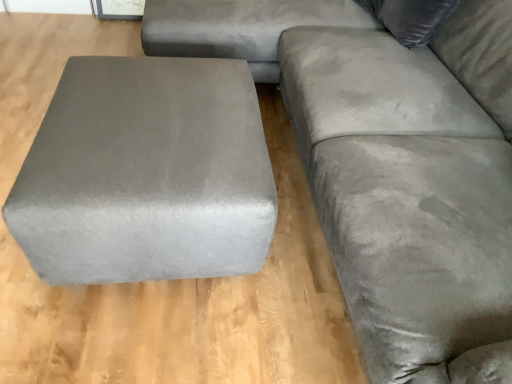
Question: Is point (233, 173) positioned closer to the camera than point (502, 286)?

Choices:
 (A) closer
 (B) farther

Answer: (B)

Question: From a real-world perspective, is satin gray ottoman at left positioned above or below suede gray couch at right?

Choices:
 (A) below
 (B) above

Answer: (A)

Question: Which is farther from the suede gray couch at right?

Choices:
 (A) satin gray ottoman at left
 (B) velvet gray pillow at upper right

Answer: (A)

Question: Which is farther from the velvet gray pillow at upper right?

Choices:
 (A) satin gray ottoman at left
 (B) suede gray couch at right

Answer: (A)